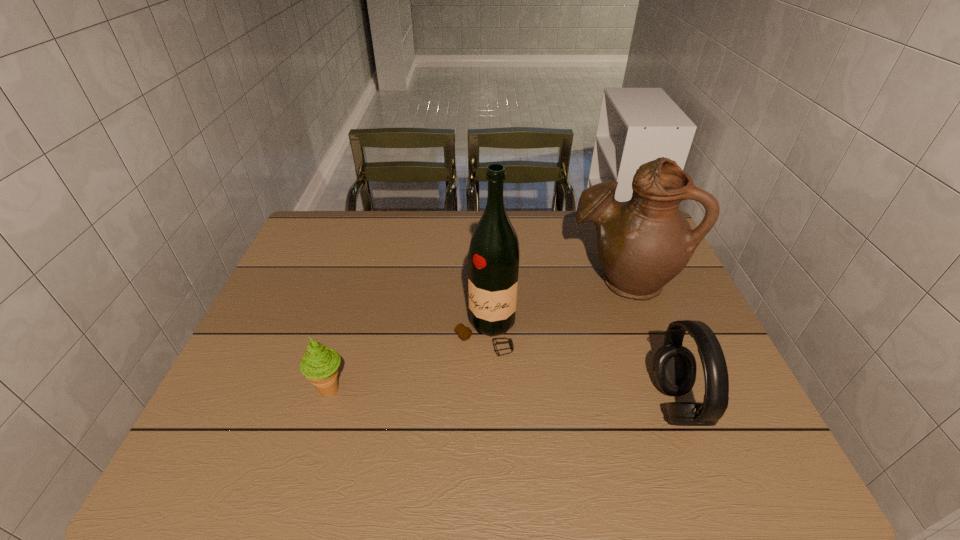
The height and width of the screenshot is (540, 960). What are the coordinates of `free spot between the headset and the second tallest object` in the screenshot? It's located at (649, 342).

At what (x,y) coordinates should I click in order to perform the action: click on vacant space in between the headset and the pitcher. Please return your answer as a coordinate pair (x, y). The image size is (960, 540). Looking at the image, I should click on (649, 342).

Find the location of `free space that is in between the icecream and the third object from right to left`. free space that is in between the icecream and the third object from right to left is located at coordinates (408, 360).

Identify the location of free spot between the icecream and the second tallest object. (476, 335).

Locate an element on the screen. object that is the second closest to the headset is located at coordinates (493, 260).

Locate an element on the screen. The height and width of the screenshot is (540, 960). the third closest object to the pitcher is located at coordinates (319, 365).

Locate an element on the screen. free space that satisfies the following two spatial constraints: 1. on the front side of the third tallest object; 2. on the earcups of the second object from left to right is located at coordinates (487, 404).

This screenshot has height=540, width=960. In order to click on vacant position in the image that satisfies the following two spatial constraints: 1. on the front side of the wine bottle; 2. on the earcups of the third tallest object in this screenshot , I will do `click(487, 404)`.

In order to click on vacant space that satisfies the following two spatial constraints: 1. on the back side of the pitcher; 2. on the left side of the shortest object in this screenshot , I will do `click(363, 280)`.

Where is `vacant space that satisfies the following two spatial constraints: 1. on the front side of the pitcher; 2. on the earcups of the second shortest object`? The image size is (960, 540). vacant space that satisfies the following two spatial constraints: 1. on the front side of the pitcher; 2. on the earcups of the second shortest object is located at coordinates (667, 404).